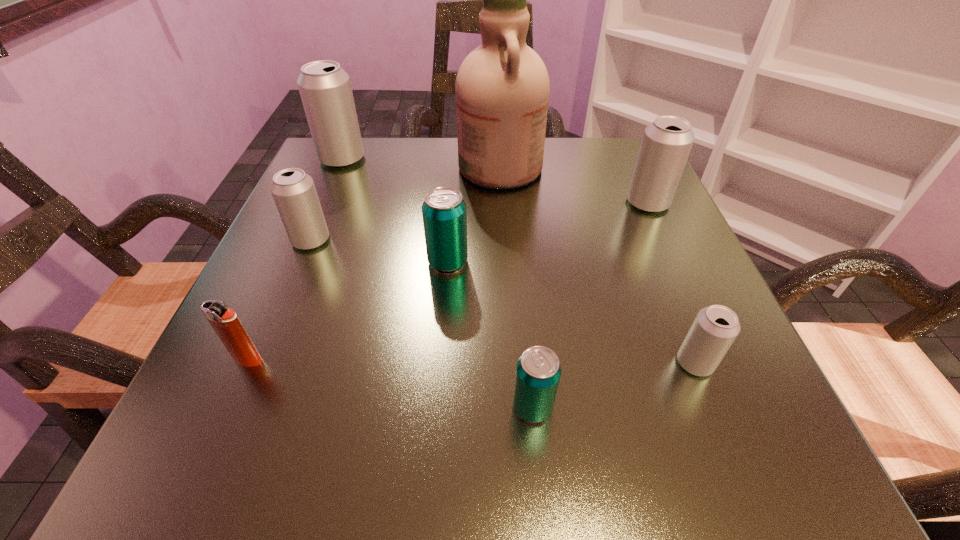
In order to click on vacant area that lies between the farthest beer can and the left teal beer can in this screenshot , I will do point(395,210).

Where is `unoccupied area between the igniter and the nearer teal beer can`? Image resolution: width=960 pixels, height=540 pixels. unoccupied area between the igniter and the nearer teal beer can is located at coordinates (391, 383).

Where is `the fourth closest object to the second nearest white beer can`? The image size is (960, 540). the fourth closest object to the second nearest white beer can is located at coordinates (502, 87).

Locate an element on the screen. This screenshot has width=960, height=540. the fifth closest object to the nearest white beer can is located at coordinates (225, 322).

Select which beer can appears as the closest to the second farthest white beer can. Please provide its 2D coordinates. Your answer should be formatted as a tuple, i.e. [(x, y)], where the tuple contains the x and y coordinates of a point satisfying the conditions above.

[(715, 328)]

Where is `the closest beer can to the nearest white beer can`? Image resolution: width=960 pixels, height=540 pixels. the closest beer can to the nearest white beer can is located at coordinates (538, 371).

This screenshot has height=540, width=960. What are the coordinates of `white beer can that is the third closest to the tallest beer can` in the screenshot? It's located at (715, 328).

Select which white beer can appears as the fourth closest to the left teal beer can. Please provide its 2D coordinates. Your answer should be formatted as a tuple, i.e. [(x, y)], where the tuple contains the x and y coordinates of a point satisfying the conditions above.

[(715, 328)]

Find the location of `vacant position in the image that satisfies the following two spatial constraints: 1. on the back side of the nearer teal beer can; 2. on the front label of the cleansing agent`. vacant position in the image that satisfies the following two spatial constraints: 1. on the back side of the nearer teal beer can; 2. on the front label of the cleansing agent is located at coordinates (511, 167).

The image size is (960, 540). I want to click on vacant position in the image that satisfies the following two spatial constraints: 1. on the front label of the fourth beer can from left to right; 2. on the left side of the tallest object, so click(x=515, y=407).